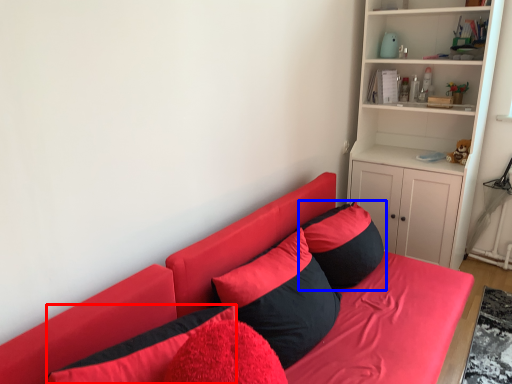
Question: Which object appears farthest to the camera in this image, pillow (highlighted by a red box) or pillow (highlighted by a blue box)?

Choices:
 (A) pillow
 (B) pillow

Answer: (B)